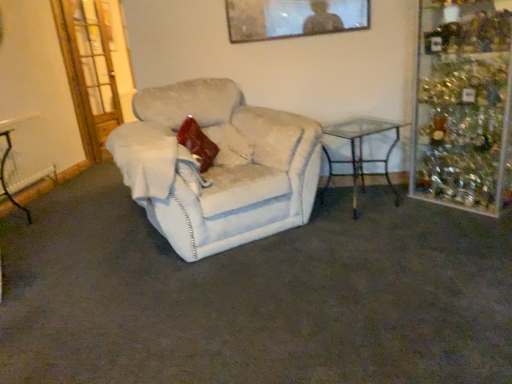
Question: Does metallic silver picture frame at upper center touch velvet red pillow at center?

Choices:
 (A) no
 (B) yes

Answer: (A)

Question: Does metallic silver picture frame at upper center lie in front of velvet red pillow at center?

Choices:
 (A) no
 (B) yes

Answer: (A)

Question: Can you confirm if metallic silver picture frame at upper center is taller than velvet red pillow at center?

Choices:
 (A) no
 (B) yes

Answer: (A)

Question: Can we say metallic silver picture frame at upper center lies outside velvet red pillow at center?

Choices:
 (A) yes
 (B) no

Answer: (A)

Question: Does metallic silver picture frame at upper center have a larger size compared to velvet red pillow at center?

Choices:
 (A) no
 (B) yes

Answer: (A)

Question: From their relative heights in the image, would you say metallic silver picture frame at upper center is taller or shorter than wooden glass door at left?

Choices:
 (A) short
 (B) tall

Answer: (A)

Question: Is point (x=310, y=9) positioned closer to the camera than point (x=75, y=23)?

Choices:
 (A) closer
 (B) farther

Answer: (A)

Question: From a real-world perspective, is metallic silver picture frame at upper center above or below wooden glass door at left?

Choices:
 (A) below
 (B) above

Answer: (B)

Question: In terms of width, does metallic silver picture frame at upper center look wider or thinner when compared to wooden glass door at left?

Choices:
 (A) thin
 (B) wide

Answer: (A)

Question: Is point (197, 160) closer or farther from the camera than point (498, 1)?

Choices:
 (A) closer
 (B) farther

Answer: (A)

Question: Considering the positions of velvet red pillow at center and glass reflective shelf at right in the image, is velvet red pillow at center wider or thinner than glass reflective shelf at right?

Choices:
 (A) thin
 (B) wide

Answer: (A)

Question: Is velvet red pillow at center situated inside glass reflective shelf at right or outside?

Choices:
 (A) outside
 (B) inside

Answer: (A)

Question: Considering their positions, is velvet red pillow at center located in front of or behind glass reflective shelf at right?

Choices:
 (A) front
 (B) behind

Answer: (B)

Question: Considering their positions, is metallic silver picture frame at upper center located in front of or behind white fabric chair at center?

Choices:
 (A) behind
 (B) front

Answer: (A)

Question: Based on their sizes in the image, would you say metallic silver picture frame at upper center is bigger or smaller than white fabric chair at center?

Choices:
 (A) big
 (B) small

Answer: (B)